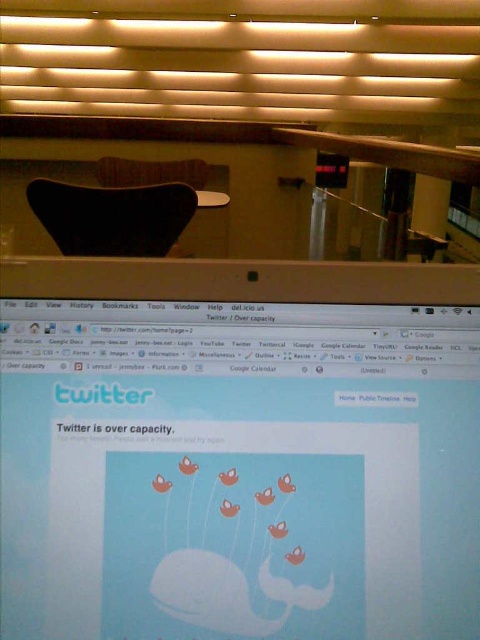
You are setting up a workspace and need to place the satin silver laptop at center so that it faces away from the black matte chair at upper center. Based on their positions, is the laptop facing towards or away from the chair?

The satin silver laptop at center is in front of the black matte chair at upper center, so it is facing away from the chair.

You are looking at the computer screen showing the Twitter error message. There are two points marked on the screen at coordinates point (422, 604) and point (119, 225). Which point is closer to your eyes when you are facing the screen?

Point (422, 604) is closer to the viewer than point (119, 225).